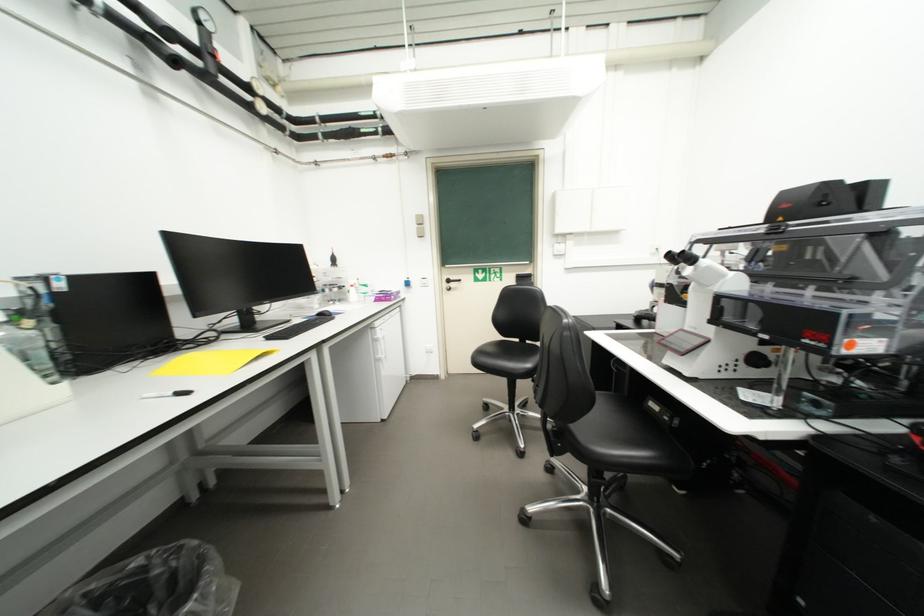
The height and width of the screenshot is (616, 924). I want to click on black computer keyboard, so coord(300,326).